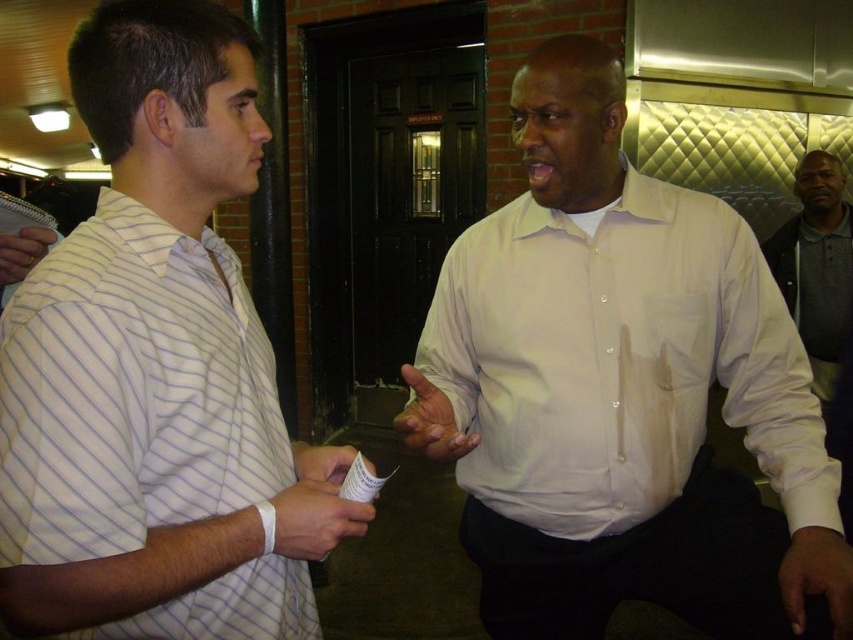
You are a photographer standing at the end of the corridor. You need to take a photo of both the white smooth shirt at center and the white striped shirt at left so that both are fully visible in the frame. Based on their heights, which person should you position closer to the camera to ensure the shorter one isn

The white smooth shirt at center is taller than the white striped shirt at left. To ensure both are fully visible, position the shorter white striped shirt at left closer to the camera so that their heights in the frame are balanced.

You are a photographer standing in the hallway and want to take a photo of the white smooth shirt at center and the dark gray polo shirt at right. Since you want both subjects to appear in the same frame, will the height difference between them affect the composition?

The white smooth shirt at center is much taller than the dark gray polo shirt at right, so their height difference may affect the composition. To ensure both are visible, adjust the camera angle or position to account for the height difference.

You are standing in the hallway and need to determine which of the two points, point [314,448] or point [843,248], is closer to you. Based on the scene, which point is nearer?

Point [314,448] is closer to the viewer than point [843,248].